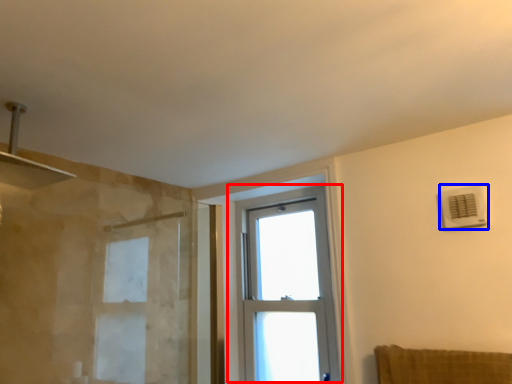
Question: Which of the following is the closest to the observer, window (highlighted by a red box) or air conditioning (highlighted by a blue box)?

Choices:
 (A) window
 (B) air conditioning

Answer: (B)